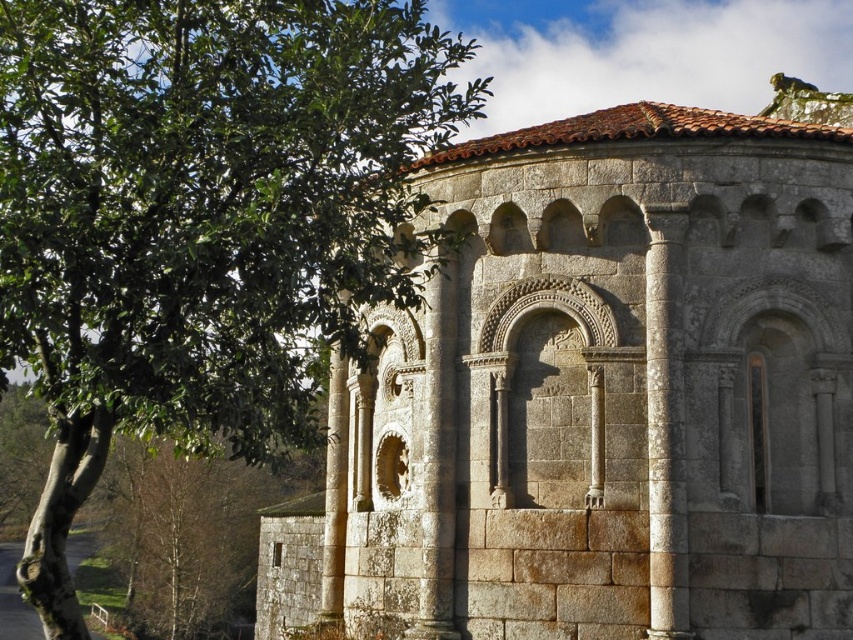
Question: Can you confirm if gray stone column at right is bigger than gray stone column at center?

Choices:
 (A) no
 (B) yes

Answer: (A)

Question: Which object is the closest to the gray stone building at center?

Choices:
 (A) gray stone column at right
 (B) green leafy tree at upper left

Answer: (B)

Question: Does gray stone building at center have a larger size compared to gray stone column at right?

Choices:
 (A) no
 (B) yes

Answer: (B)

Question: Among these points, which one is farthest from the camera?

Choices:
 (A) (432, 573)
 (B) (660, 563)

Answer: (A)

Question: Does gray stone building at center have a lesser width compared to gray stone column at right?

Choices:
 (A) yes
 (B) no

Answer: (B)

Question: Which point is farther to the camera?

Choices:
 (A) (469, 536)
 (B) (422, 481)
 (C) (665, 508)

Answer: (B)